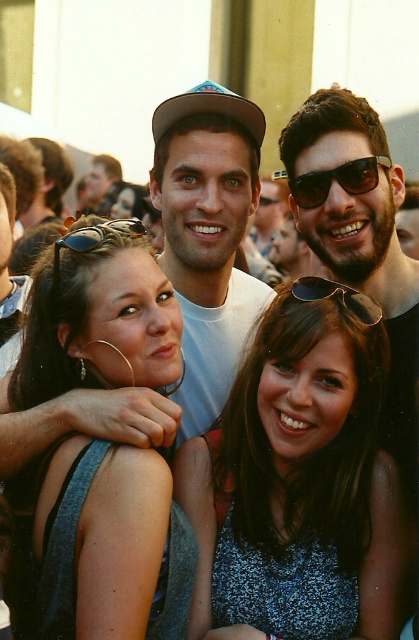
Can you confirm if white t-shirt at center is shorter than sunglasses at upper center?

No.

Looking at this image, can you confirm if white t-shirt at center is thinner than sunglasses at upper center?

No.

This screenshot has height=640, width=419. Describe the element at coordinates (207, 236) in the screenshot. I see `white t-shirt at center` at that location.

At what (x,y) coordinates should I click in order to perform the action: click on white t-shirt at center. Please return your answer as a coordinate pair (x, y). Looking at the image, I should click on (207, 236).

Is matte gray tank top at center below black plastic sunglasses at center?

Indeed, matte gray tank top at center is positioned under black plastic sunglasses at center.

Can you confirm if matte gray tank top at center is positioned to the left of black plastic sunglasses at center?

Indeed, matte gray tank top at center is positioned on the left side of black plastic sunglasses at center.

Measure the distance between point [69,353] and camera.

Point [69,353] and camera are 73.31 feet apart.

You are a GUI agent. You are given a task and a screenshot of the screen. Output one action in this format:
    pyautogui.click(x=<x>, y=<y>)
    Task: Click on the matte gray tank top at center
    The width and height of the screenshot is (419, 640).
    Given the screenshot: What is the action you would take?
    pyautogui.click(x=97, y=545)

Does sparkly blue dress at center come in front of black plastic sunglasses at center?

Yes.

Is sparkly blue dress at center shorter than black plastic sunglasses at center?

In fact, sparkly blue dress at center may be taller than black plastic sunglasses at center.

Who is more distant from viewer, (351, 528) or (315, 300)?

The point (315, 300) is behind.

Locate an element on the screen. sparkly blue dress at center is located at coordinates (299, 486).